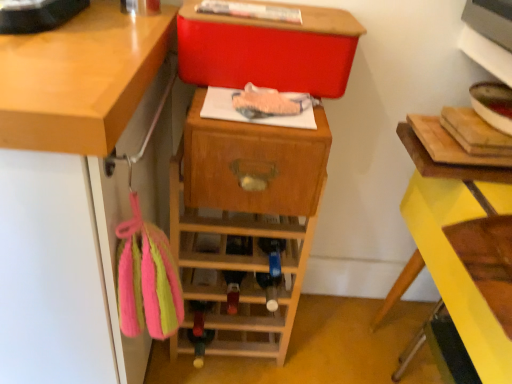
Find the location of `free space above matte red storage box at upper center (from a real-world perspective)`. free space above matte red storage box at upper center (from a real-world perspective) is located at coordinates [x=283, y=6].